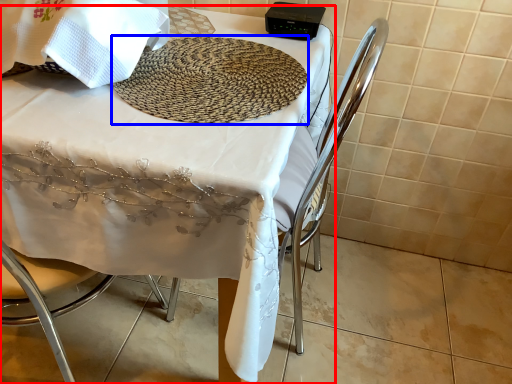
Question: Which point is closer to the camera, table (highlighted by a red box) or mat (highlighted by a blue box)?

Choices:
 (A) table
 (B) mat

Answer: (A)